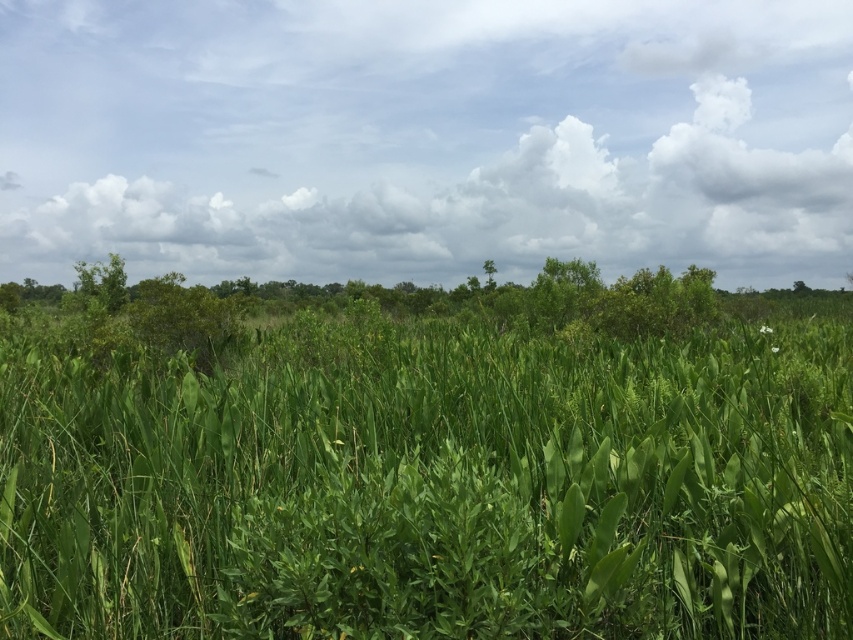
This screenshot has height=640, width=853. Identify the location of green leafy grass at center. (434, 490).

Does green leafy grass at center have a greater width compared to cloudy sky at upper center?

Incorrect, green leafy grass at center's width does not surpass cloudy sky at upper center's.

Between point (775, 516) and point (361, 116), which one is positioned behind?

The point (361, 116) is behind.

Locate an element on the screen. The height and width of the screenshot is (640, 853). green leafy grass at center is located at coordinates (434, 490).

Is cloudy sky at upper center behind green leafy tree at center?

No, it is not.

What do you see at coordinates (425, 138) in the screenshot? I see `cloudy sky at upper center` at bounding box center [425, 138].

Between point (281, 125) and point (488, 280), which one is positioned in front?

Point (281, 125) is more forward.

Identify the location of cloudy sky at upper center. (425, 138).

In the scene shown: Is the position of green leafy grass at center more distant than that of green leafy tree at center?

No, green leafy grass at center is in front of green leafy tree at center.

Does green leafy grass at center have a lesser width compared to green leafy tree at center?

In fact, green leafy grass at center might be wider than green leafy tree at center.

I want to click on green leafy grass at center, so click(x=434, y=490).

Where is `green leafy grass at center`? green leafy grass at center is located at coordinates (434, 490).